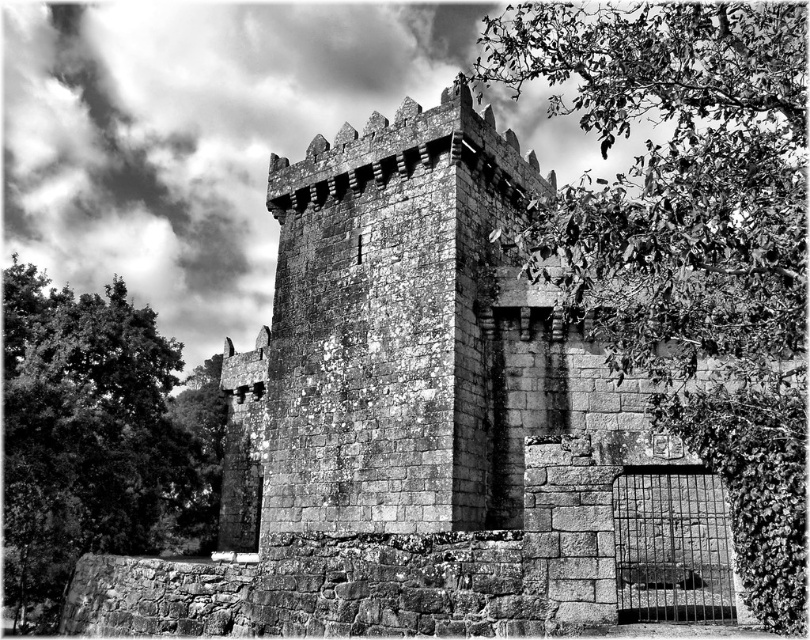
Does green leafy tree at upper right have a lesser width compared to green leafy tree at left?

Correct, green leafy tree at upper right's width is less than green leafy tree at left's.

At what (x,y) coordinates should I click in order to perform the action: click on green leafy tree at upper right. Please return your answer as a coordinate pair (x, y). Looking at the image, I should click on (689, 240).

Is point (783, 68) closer to viewer compared to point (150, 404)?

Yes.

In order to click on green leafy tree at upper right in this screenshot , I will do `click(689, 240)`.